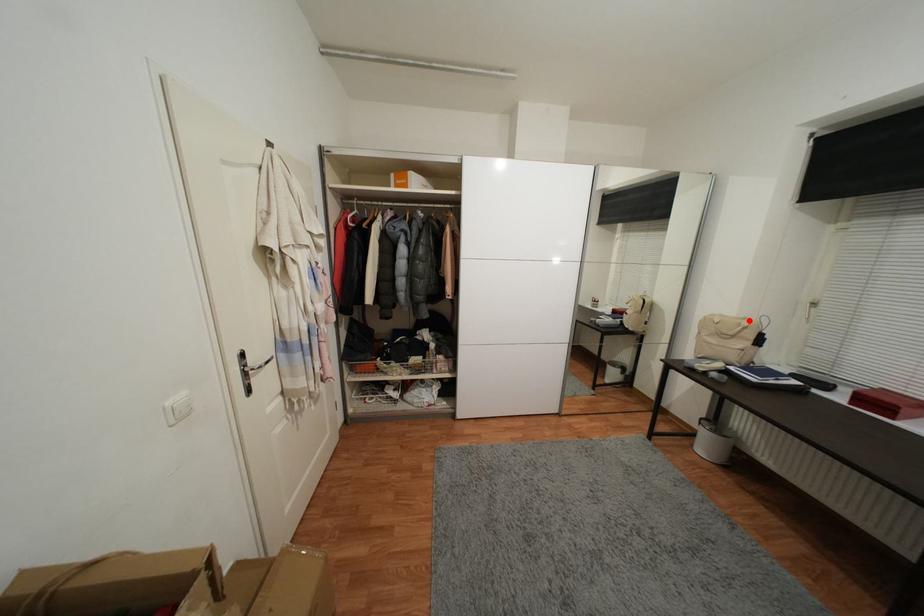
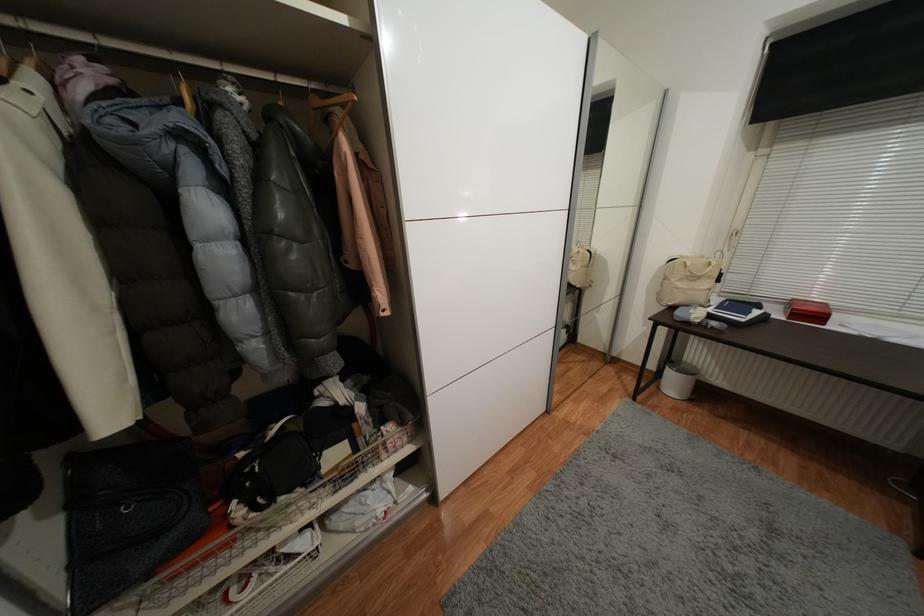
Where in the second image is the point corresponding to the highlighted location from the first image?

(707, 257)